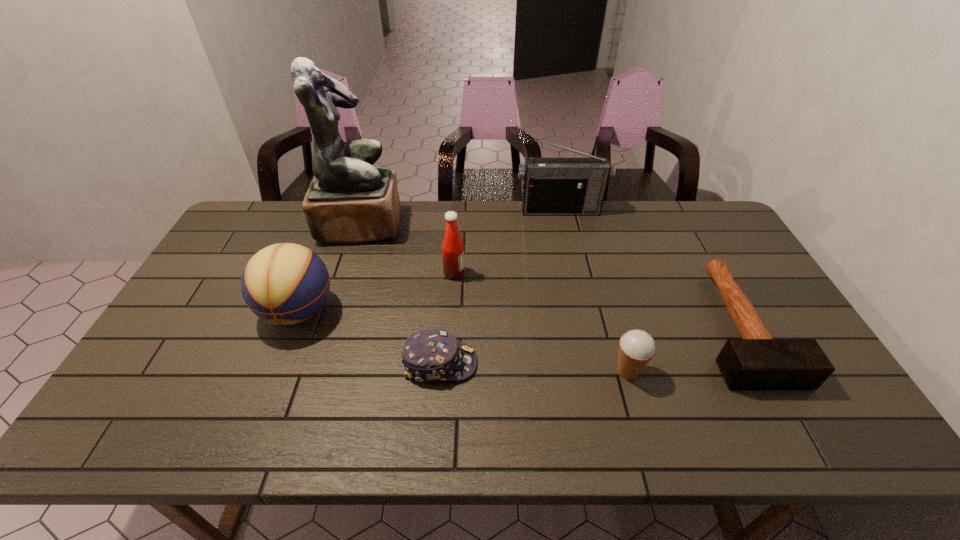
The image size is (960, 540). I want to click on blank region between the basketball and the mallet, so click(x=517, y=318).

Locate an element on the screen. vacant region between the second tallest object and the condiment is located at coordinates (507, 241).

This screenshot has height=540, width=960. Find the location of `the third closest object relative to the basketball`. the third closest object relative to the basketball is located at coordinates (452, 247).

At what (x,y) coordinates should I click in order to perform the action: click on object that can be found as the closest to the condiment. Please return your answer as a coordinate pair (x, y). The image size is (960, 540). Looking at the image, I should click on (349, 201).

At what (x,y) coordinates should I click in order to perform the action: click on vacant space that satisfies the following two spatial constraints: 1. on the front-facing side of the sixth shortest object; 2. on the front-facing side of the headwear. Please return your answer as a coordinate pair (x, y). Looking at the image, I should click on (594, 363).

Identify the location of free space that satisfies the following two spatial constraints: 1. on the front-facing side of the sixth shortest object; 2. on the front-facing side of the condiment. (574, 273).

The height and width of the screenshot is (540, 960). What are the coordinates of `free point that satisfies the following two spatial constraints: 1. in a relaxed pose on the tallest object; 2. on the patterned surface of the basketball` in the screenshot? It's located at (333, 311).